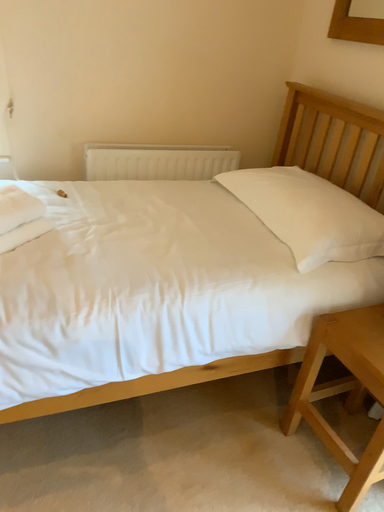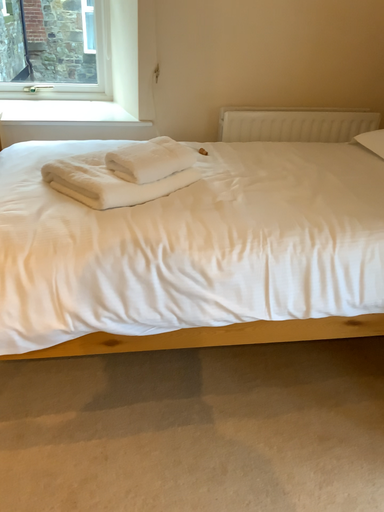
Question: How did the camera likely rotate when shooting the video?

Choices:
 (A) rotated right
 (B) rotated left

Answer: (B)